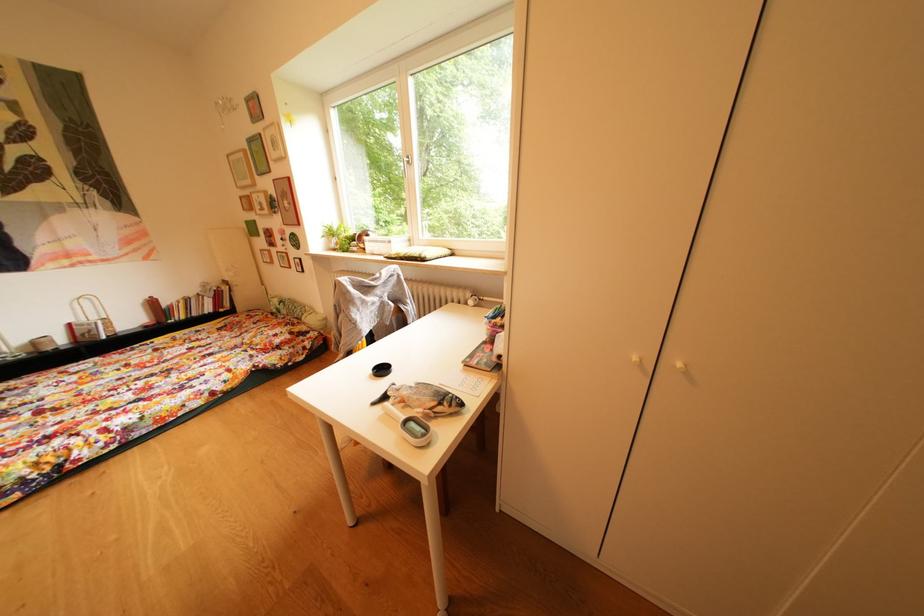
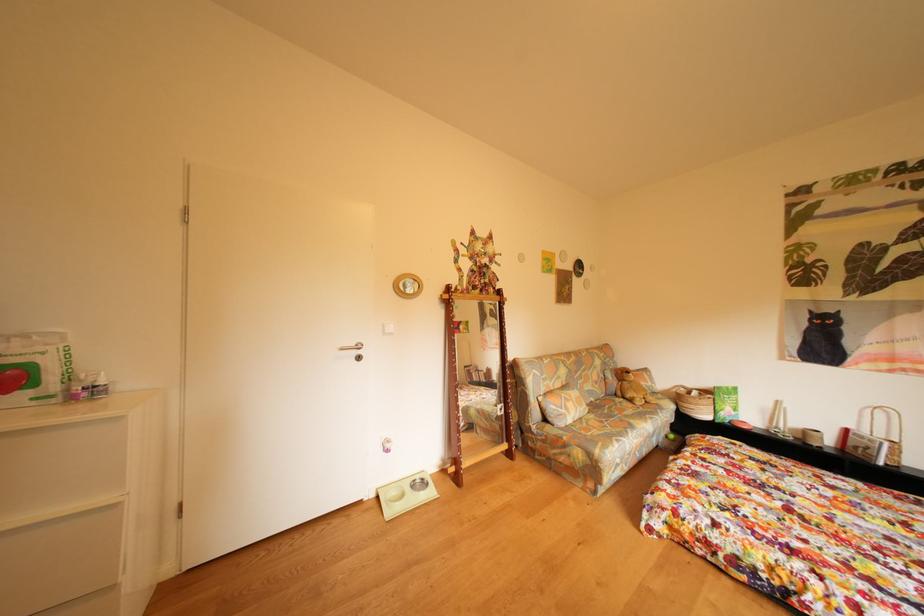
Question: The camera is either moving clockwise (left) or counter-clockwise (right) around the object. The first image is from the beginning of the video and the second image is from the end. Is the camera moving left or right when shooting the video?

Choices:
 (A) Left
 (B) Right

Answer: (B)